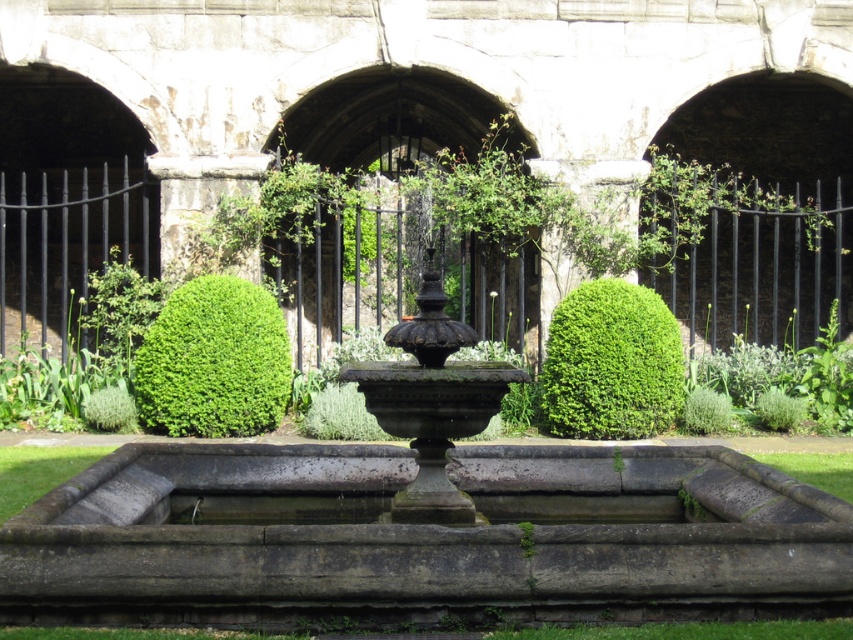
You are a gardener standing at the edge of the garden, and you need to water both the green leafy bush at left and the green leafy bush at center. If your watering can has a range of 4 meters, can you water both bushes without moving closer?

The green leafy bush at left is 4.40 meters away from the green leafy bush at center. Since your watering can has a range of 4 meters, you cannot reach both bushes without moving closer because the distance between them exceeds the watering can range.

You are standing in the garden scene and want to place a small statue exactly at the point marked by coordinates point (x=213, y=362). The garden has a stone fountain in the center and two symmetrical green bushes. Which object in the garden is the point located on?

The point (x=213, y=362) is located on the green leafy bush at left.